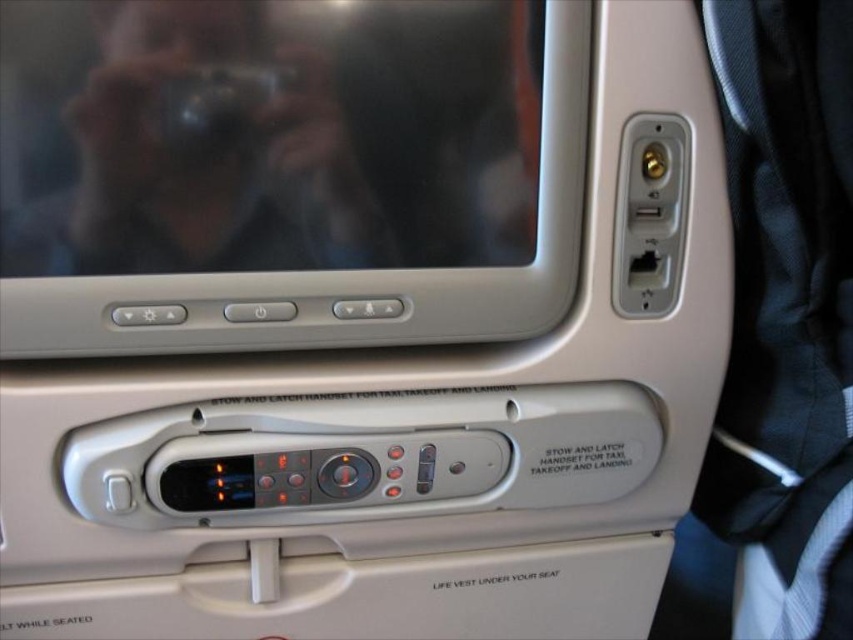
Question: Can you confirm if satin silver screen at upper center is smaller than metallic black camera at upper center?

Choices:
 (A) yes
 (B) no

Answer: (B)

Question: Considering the real-world distances, which object is closest to the satin silver screen at upper center?

Choices:
 (A) metallic silver camera at upper left
 (B) metallic black camera at upper center

Answer: (A)

Question: Considering the relative positions of metallic silver camera at upper left and metallic black camera at upper center in the image provided, where is metallic silver camera at upper left located with respect to metallic black camera at upper center?

Choices:
 (A) left
 (B) right

Answer: (B)

Question: Observing the image, what is the correct spatial positioning of satin silver screen at upper center in reference to metallic black camera at upper center?

Choices:
 (A) above
 (B) below

Answer: (B)

Question: Considering the real-world distances, which object is closest to the metallic black camera at upper center?

Choices:
 (A) metallic silver camera at upper left
 (B) satin silver screen at upper center

Answer: (A)

Question: Which point is closer to the camera?

Choices:
 (A) metallic black camera at upper center
 (B) satin silver screen at upper center
 (C) metallic silver camera at upper left

Answer: (C)